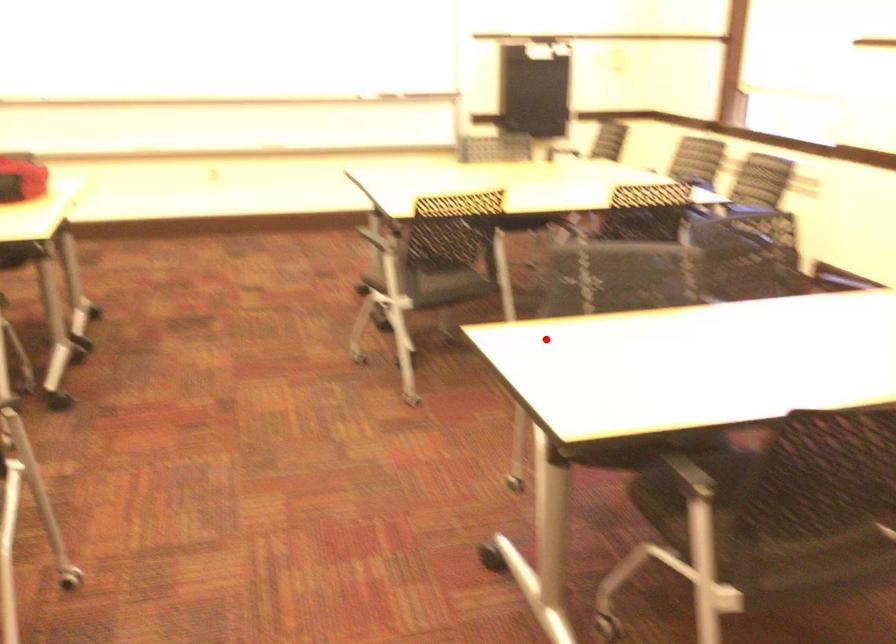
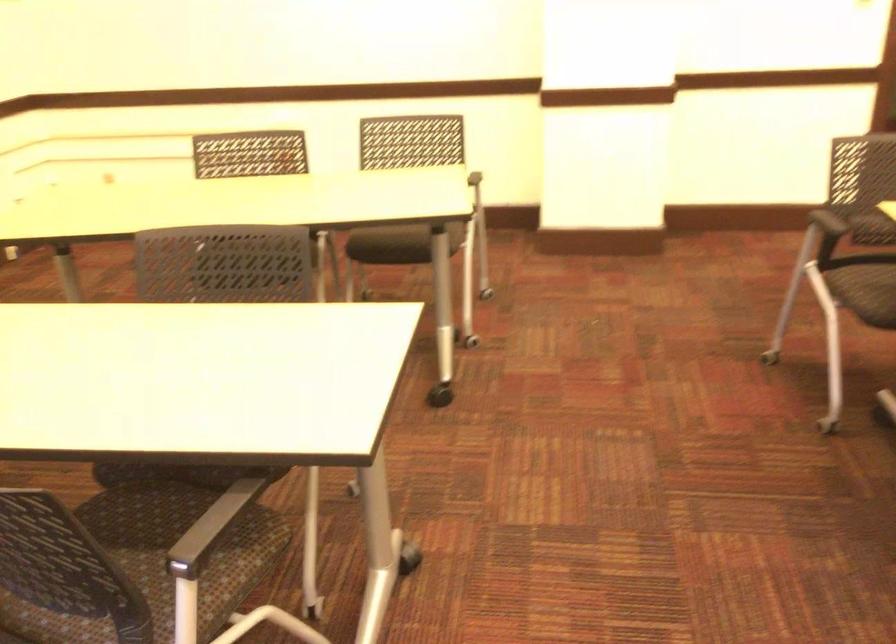
Find the pixel in the second image that matches the highlighted location in the first image.

(210, 527)